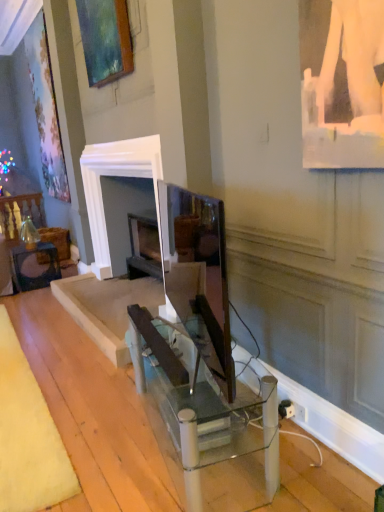
I want to click on matte glass table at lower left, the 2th table from the right, so click(34, 267).

Identify the location of clear glass table at center, the second table when ordered from left to right. This screenshot has height=512, width=384. (203, 422).

Identify the location of matte black monitor at center. The image size is (384, 512). (198, 275).

The height and width of the screenshot is (512, 384). What do you see at coordinates (198, 275) in the screenshot?
I see `matte black monitor at center` at bounding box center [198, 275].

Identify the location of matte glass table at lower left, the 2th table from the right. (34, 267).

Is matte glass table at lower left, which is the 1th table from back to front, located within clear glass table at center, the 1th table viewed from the front?

No, matte glass table at lower left, which is the 1th table from back to front, is located outside of clear glass table at center, the 1th table viewed from the front.

Between clear glass table at center, which appears as the 2th table when viewed from the back, and matte glass table at lower left, the first table viewed from the top, which one has larger size?

Bigger between the two is clear glass table at center, which appears as the 2th table when viewed from the back.

Between clear glass table at center, acting as the first table starting from the right, and matte glass table at lower left, which ranks as the second table in bottom-to-top order, which one has more height?

With more height is clear glass table at center, acting as the first table starting from the right.

Could you measure the distance between clear glass table at center, the second table when ordered from left to right, and matte glass table at lower left, which ranks as the second table in bottom-to-top order?

clear glass table at center, the second table when ordered from left to right, is 3.50 meters away from matte glass table at lower left, which ranks as the second table in bottom-to-top order.

Based on the photo, is clear glass table at center, the second table when ordered from left to right, to the left of matte black monitor at center from the viewer's perspective?

In fact, clear glass table at center, the second table when ordered from left to right, is to the right of matte black monitor at center.

Would you consider clear glass table at center, which ranks as the first table in bottom-to-top order, to be distant from matte black monitor at center?

No, clear glass table at center, which ranks as the first table in bottom-to-top order, is not far away from matte black monitor at center.

Which object is closer to the camera taking this photo, clear glass table at center, acting as the first table starting from the right, or matte black monitor at center?

matte black monitor at center is more forward.

From the image's perspective, between clear glass table at center, acting as the first table starting from the right, and matte black monitor at center, which one is located above?

matte black monitor at center.

Is clear glass table at center, acting as the first table starting from the right, beside matte wooden picture frame at upper left?

There is a gap between clear glass table at center, acting as the first table starting from the right, and matte wooden picture frame at upper left.

You are a GUI agent. You are given a task and a screenshot of the screen. Output one action in this format:
    pyautogui.click(x=<x>, y=<y>)
    Task: Click on the table in front of the matte wooden picture frame at upper left
    
    Given the screenshot: What is the action you would take?
    [x=203, y=422]

Could you measure the distance between clear glass table at center, the second table when ordered from left to right, and matte wooden picture frame at upper left?

The distance of clear glass table at center, the second table when ordered from left to right, from matte wooden picture frame at upper left is 2.53 meters.

Is clear glass table at center, which appears as the 2th table when viewed from the back, at the left side of matte wooden picture frame at upper left?

No, clear glass table at center, which appears as the 2th table when viewed from the back, is not to the left of matte wooden picture frame at upper left.

Is matte wooden picture frame at upper left touching matte glass table at lower left, which ranks as the second table in bottom-to-top order?

matte wooden picture frame at upper left is not next to matte glass table at lower left, which ranks as the second table in bottom-to-top order, and they're not touching.

Can you confirm if matte wooden picture frame at upper left is taller than matte glass table at lower left, the 2th table from the right?

Yes, matte wooden picture frame at upper left is taller than matte glass table at lower left, the 2th table from the right.

Is matte wooden picture frame at upper left positioned with its back to matte glass table at lower left, the first table viewed from the top?

No, matte glass table at lower left, the first table viewed from the top, is not at the back of matte wooden picture frame at upper left.

Is matte wooden picture frame at upper left positioned before matte glass table at lower left, which ranks as the second table in bottom-to-top order?

Yes, it is in front of matte glass table at lower left, which ranks as the second table in bottom-to-top order.

Could clear glass table at center, which ranks as the first table in bottom-to-top order, be considered to be inside matte glass table at lower left, which ranks as the second table in bottom-to-top order?

No, clear glass table at center, which ranks as the first table in bottom-to-top order, is not a part of matte glass table at lower left, which ranks as the second table in bottom-to-top order.

Is the surface of matte glass table at lower left, which ranks as the second table in bottom-to-top order, in direct contact with clear glass table at center, the second table viewed from the top?

matte glass table at lower left, which ranks as the second table in bottom-to-top order, and clear glass table at center, the second table viewed from the top, are clearly separated.

Which object is further away from the camera, matte glass table at lower left, the first table viewed from the top, or clear glass table at center, which appears as the 2th table when viewed from the back?

matte glass table at lower left, the first table viewed from the top, is further away from the camera.

Is point (50, 272) more distant than point (209, 410)?

Yes, point (50, 272) is farther from viewer.

Is matte glass table at lower left, arranged as the 2th table when viewed from the front, positioned with its back to matte wooden picture frame at upper left?

No, matte glass table at lower left, arranged as the 2th table when viewed from the front, is not facing away from matte wooden picture frame at upper left.

Considering the relative sizes of matte glass table at lower left, the 2th table from the right, and matte wooden picture frame at upper left in the image provided, is matte glass table at lower left, the 2th table from the right, wider than matte wooden picture frame at upper left?

Yes, matte glass table at lower left, the 2th table from the right, is wider than matte wooden picture frame at upper left.

Looking at this image, does matte glass table at lower left, the first table viewed from the top, lie behind matte wooden picture frame at upper left?

Yes, the depth of matte glass table at lower left, the first table viewed from the top, is greater than that of matte wooden picture frame at upper left.

From the image's perspective, is matte glass table at lower left, which is the 1th table from back to front, below matte wooden picture frame at upper left?

Correct, matte glass table at lower left, which is the 1th table from back to front, appears lower than matte wooden picture frame at upper left in the image.

Considering the positions of point (201, 284) and point (107, 78), is point (201, 284) closer or farther from the camera than point (107, 78)?

Clearly, point (201, 284) is closer to the camera than point (107, 78).

Is matte black monitor at center inside or outside of matte wooden picture frame at upper left?

matte black monitor at center exists outside the volume of matte wooden picture frame at upper left.

From the image's perspective, is matte black monitor at center positioned above or below matte wooden picture frame at upper left?

Clearly, from the image's perspective, matte black monitor at center is below matte wooden picture frame at upper left.

Are matte black monitor at center and matte wooden picture frame at upper left located far from each other?

matte black monitor at center is positioned a significant distance from matte wooden picture frame at upper left.

Image resolution: width=384 pixels, height=512 pixels. In order to click on table below the matte glass table at lower left, which is the 1th table from back to front (from the image's perspective) in this screenshot , I will do 203,422.

In order to click on computer monitor that is above the clear glass table at center, which appears as the 2th table when viewed from the back (from the image's perspective) in this screenshot , I will do `click(198, 275)`.

When comparing their distances from clear glass table at center, which ranks as the first table in bottom-to-top order, does matte glass table at lower left, arranged as the 2th table when viewed from the front, or matte wooden picture frame at upper left seem closer?

matte wooden picture frame at upper left lies closer to clear glass table at center, which ranks as the first table in bottom-to-top order, than the other object.

From the image, which object appears to be nearer to matte glass table at lower left, which is the 1th table from back to front, matte black monitor at center or clear glass table at center, the 1th table viewed from the front?

Among the two, matte black monitor at center is located nearer to matte glass table at lower left, which is the 1th table from back to front.

Considering their positions, is matte black monitor at center positioned further to clear glass table at center, which ranks as the first table in bottom-to-top order, than matte glass table at lower left, the first table viewed from the top?

matte glass table at lower left, the first table viewed from the top, is further to clear glass table at center, which ranks as the first table in bottom-to-top order.

Considering their positions, is clear glass table at center, the second table viewed from the top, positioned further to matte glass table at lower left, which is the 1th table from back to front, than matte black monitor at center?

Among the two, clear glass table at center, the second table viewed from the top, is located further to matte glass table at lower left, which is the 1th table from back to front.

From the image, which object appears to be farther from matte black monitor at center, clear glass table at center, acting as the first table starting from the right, or matte wooden picture frame at upper left?

Among the two, matte wooden picture frame at upper left is located further to matte black monitor at center.

From the image, which object appears to be nearer to matte black monitor at center, matte glass table at lower left, arranged as the 2th table when viewed from the front, or matte wooden picture frame at upper left?

The object closer to matte black monitor at center is matte wooden picture frame at upper left.

From the image, which object appears to be nearer to matte wooden picture frame at upper left, matte black monitor at center or clear glass table at center, acting as the first table starting from the right?

matte black monitor at center.

Considering their positions, is clear glass table at center, the second table viewed from the top, positioned further to matte black monitor at center than matte glass table at lower left, arranged as the 2th table when viewed from the front?

matte glass table at lower left, arranged as the 2th table when viewed from the front, is positioned further to the anchor matte black monitor at center.

Where is `picture frame positioned between matte black monitor at center and matte glass table at lower left, acting as the 1th table starting from the left, from near to far`? The height and width of the screenshot is (512, 384). picture frame positioned between matte black monitor at center and matte glass table at lower left, acting as the 1th table starting from the left, from near to far is located at coordinates pos(105,40).

Locate an element on the screen. The width and height of the screenshot is (384, 512). computer monitor between matte wooden picture frame at upper left and clear glass table at center, the second table viewed from the top, in the vertical direction is located at coordinates (198, 275).

You are a GUI agent. You are given a task and a screenshot of the screen. Output one action in this format:
    pyautogui.click(x=<x>, y=<y>)
    Task: Click on the table between matte black monitor at center and matte glass table at lower left, which ranks as the second table in bottom-to-top order, from front to back
    
    Given the screenshot: What is the action you would take?
    pyautogui.click(x=203, y=422)

You are a GUI agent. You are given a task and a screenshot of the screen. Output one action in this format:
    pyautogui.click(x=<x>, y=<y>)
    Task: Click on the picture frame located between clear glass table at center, the second table viewed from the top, and matte glass table at lower left, which ranks as the second table in bottom-to-top order, in the depth direction
    The height and width of the screenshot is (512, 384).
    Given the screenshot: What is the action you would take?
    pyautogui.click(x=105, y=40)